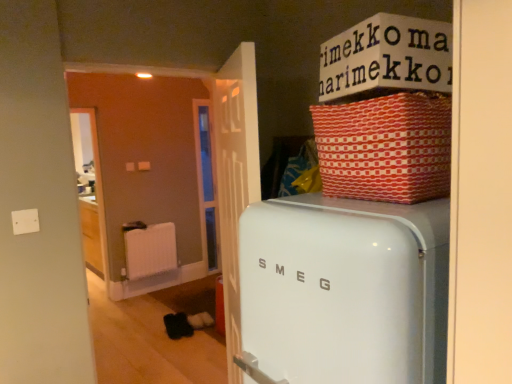
Question: In terms of size, does red woven basket at upper right appear bigger or smaller than white cardboard box at upper center?

Choices:
 (A) small
 (B) big

Answer: (B)

Question: From the image's perspective, relative to white cardboard box at upper center, is red woven basket at upper right above or below?

Choices:
 (A) below
 (B) above

Answer: (A)

Question: Which object is positioned closest to the red woven basket at upper right?

Choices:
 (A) white plastic radiator at center
 (B) white glossy refrigerator at center
 (C) white cardboard box at upper center

Answer: (C)

Question: Estimate the real-world distances between objects in this image. Which object is closer to the white glossy refrigerator at center?

Choices:
 (A) red woven basket at upper right
 (B) white cardboard box at upper center
 (C) white plastic radiator at center

Answer: (A)